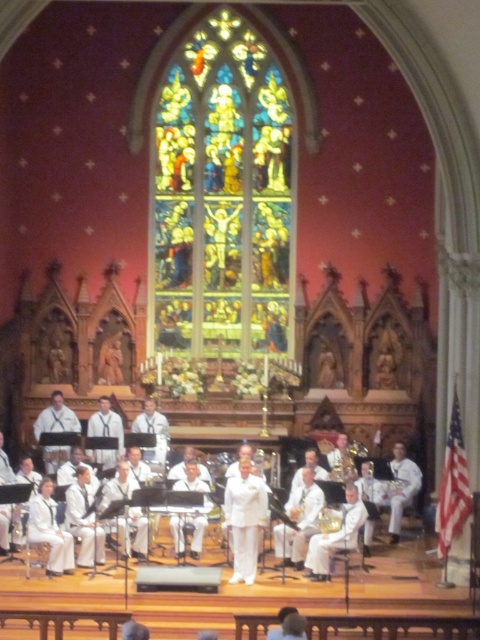
You are a photographer standing at the back of the church. You want to take a photo of the gold metallic saxophone at center and the stained glass window at center. Which object will appear larger in the photo?

The stained glass window at center is taller than the gold metallic saxophone at center, so it will appear larger in the photo.

You are standing at the entrance of the cathedral and want to locate the performer wearing the white uniform at center. According to the coordinate system where the bottom left corner is the origin, can you determine if the performer is closer to the front or back of the cathedral?

The white uniform at center is located at coordinates point (x=296, y=428). Since the y coordinate is 0.617, which is closer to 0.5 than 1, it is closer to the center than the back. However, in a coordinate system where the bottom left is the origin, the y increases upwards, so higher y means closer to the top. Therefore, the performer is closer to the front of the cathedral.

You are an audience member sitting in the front row of the church. You want to see both the stained glass window at center and the white uniform at center clearly. Which object will you need to look past the other to see?

The white uniform at center is behind the stained glass window at center, so to see the white uniform at center, you would need to look past the stained glass window at center. However, since the stained glass window is at the back, you can see it directly without obstruction from the white uniform at center.